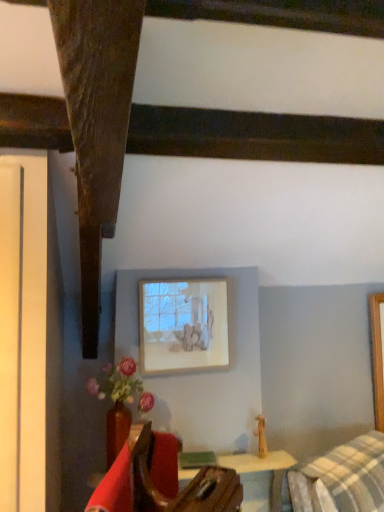
Question: Looking at the image, does velvet red armchair at lower left seem bigger or smaller compared to matte ceramic vase at lower left?

Choices:
 (A) small
 (B) big

Answer: (B)

Question: Is velvet red armchair at lower left in front of or behind matte ceramic vase at lower left in the image?

Choices:
 (A) behind
 (B) front

Answer: (B)

Question: Which object is the closest to the matte ceramic vase at lower left?

Choices:
 (A) matte white picture frame at upper center
 (B) velvet red armchair at lower left

Answer: (A)

Question: Which of these objects is positioned closest to the velvet red armchair at lower left?

Choices:
 (A) matte ceramic vase at lower left
 (B) matte white picture frame at upper center

Answer: (A)